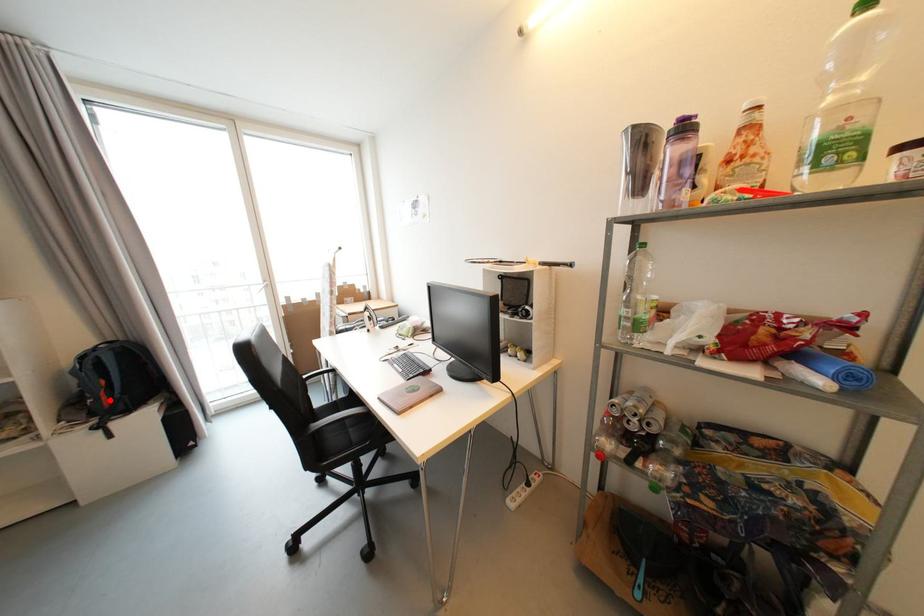
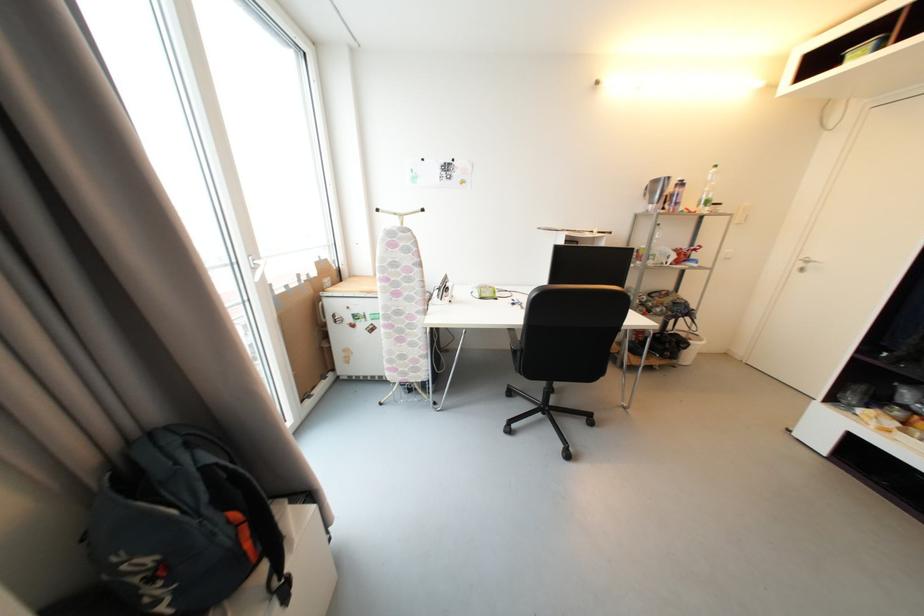
Locate, in the second image, the point that corresponds to the highlighted location in the first image.

(253, 546)